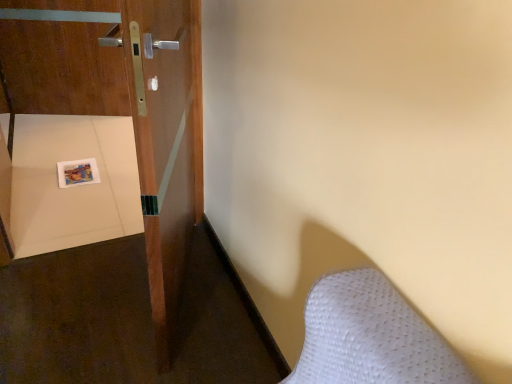
Question: Is wooden door at left behind matte plastic tray at lower left?

Choices:
 (A) yes
 (B) no

Answer: (B)

Question: Considering the relative sizes of wooden door at left and matte plastic tray at lower left in the image provided, is wooden door at left shorter than matte plastic tray at lower left?

Choices:
 (A) no
 (B) yes

Answer: (A)

Question: Is wooden door at left positioned with its back to matte plastic tray at lower left?

Choices:
 (A) yes
 (B) no

Answer: (A)

Question: Is wooden door at left closer to camera compared to matte plastic tray at lower left?

Choices:
 (A) yes
 (B) no

Answer: (A)

Question: Can you confirm if wooden door at left is thinner than matte plastic tray at lower left?

Choices:
 (A) no
 (B) yes

Answer: (B)

Question: Is wooden door at left bigger than matte plastic tray at lower left?

Choices:
 (A) yes
 (B) no

Answer: (A)

Question: From the image's perspective, does matte plastic tray at lower left appear lower than wooden door at left?

Choices:
 (A) yes
 (B) no

Answer: (A)

Question: From a real-world perspective, is matte plastic tray at lower left on top of wooden door at left?

Choices:
 (A) yes
 (B) no

Answer: (B)

Question: Is the depth of matte plastic tray at lower left less than that of wooden door at left?

Choices:
 (A) no
 (B) yes

Answer: (A)

Question: Can you confirm if matte plastic tray at lower left is wider than wooden door at left?

Choices:
 (A) no
 (B) yes

Answer: (B)

Question: Is matte plastic tray at lower left outside of wooden door at left?

Choices:
 (A) yes
 (B) no

Answer: (A)

Question: Does matte plastic tray at lower left have a lesser height compared to wooden door at left?

Choices:
 (A) no
 (B) yes

Answer: (B)

Question: Is wooden door at left bigger or smaller than matte plastic tray at lower left?

Choices:
 (A) big
 (B) small

Answer: (A)